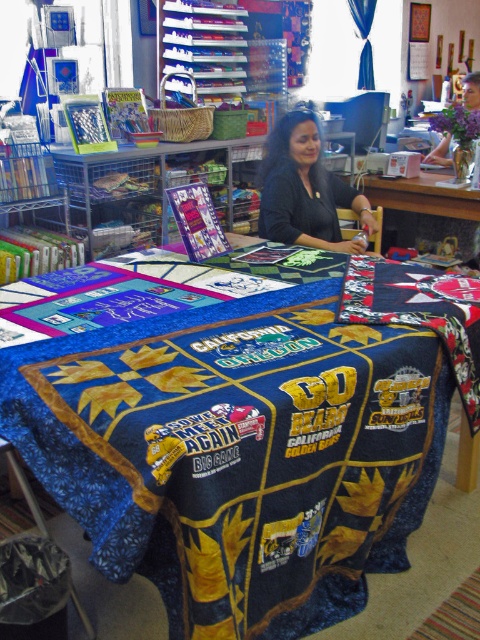
Which is in front, point (288, 358) or point (425, 180)?

Point (288, 358)

Does blue fabric quilt at center appear on the right side of wooden table at center?

No, blue fabric quilt at center is not to the right of wooden table at center.

Find the location of `blue fabric quilt at center`. blue fabric quilt at center is located at coordinates (237, 452).

Does metallic wire bookshelf at center appear on the left side of black fabric at center?

Indeed, metallic wire bookshelf at center is positioned on the left side of black fabric at center.

Who is positioned more to the right, metallic wire bookshelf at center or black fabric at center?

black fabric at center is more to the right.

I want to click on metallic wire bookshelf at center, so click(x=147, y=186).

Does blue fabric quilt at center appear on the left side of metallic wire bookshelf at center?

No, blue fabric quilt at center is not to the left of metallic wire bookshelf at center.

Is blue fabric quilt at center wider than metallic wire bookshelf at center?

Correct, the width of blue fabric quilt at center exceeds that of metallic wire bookshelf at center.

Is point (276, 356) more distant than point (122, 221)?

No, (276, 356) is in front of (122, 221).

You are a GUI agent. You are given a task and a screenshot of the screen. Output one action in this format:
    pyautogui.click(x=<x>, y=<y>)
    Task: Click on the blue fabric quilt at center
    
    Given the screenshot: What is the action you would take?
    (x=237, y=452)